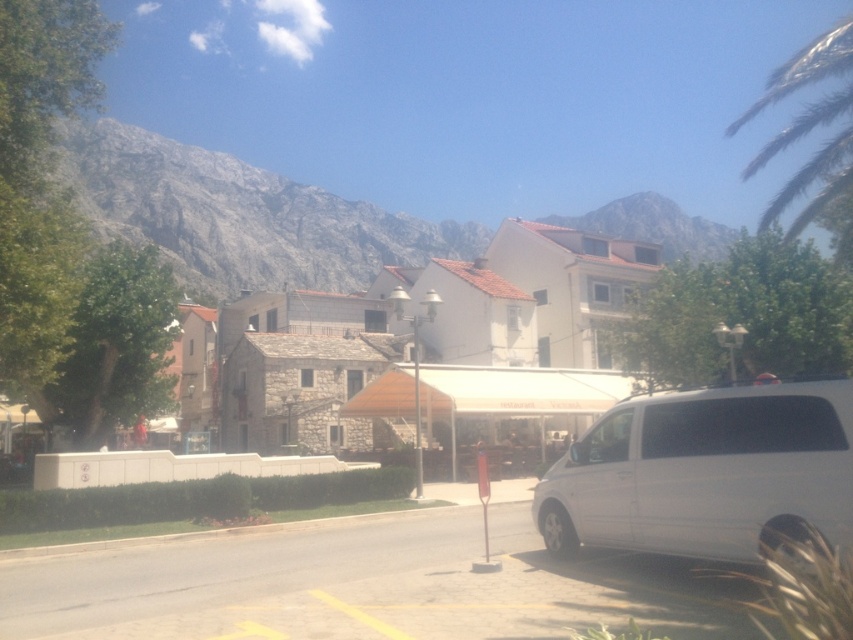
Question: Which object is the closest to the green leafy palm tree at upper right?

Choices:
 (A) white matte minivan at lower right
 (B) gray rock mountain at upper left

Answer: (A)

Question: Is white matte minivan at lower right above green leafy palm tree at upper right?

Choices:
 (A) no
 (B) yes

Answer: (A)

Question: Does gray rock mountain at upper left appear on the left side of green leafy palm tree at upper right?

Choices:
 (A) no
 (B) yes

Answer: (B)

Question: Estimate the real-world distances between objects in this image. Which object is farther from the green leafy palm tree at upper right?

Choices:
 (A) gray rock mountain at upper left
 (B) white matte minivan at lower right

Answer: (A)

Question: Which object appears closest to the camera in this image?

Choices:
 (A) white matte minivan at lower right
 (B) gray rock mountain at upper left

Answer: (A)

Question: Is white matte minivan at lower right thinner than gray rock mountain at upper left?

Choices:
 (A) yes
 (B) no

Answer: (A)